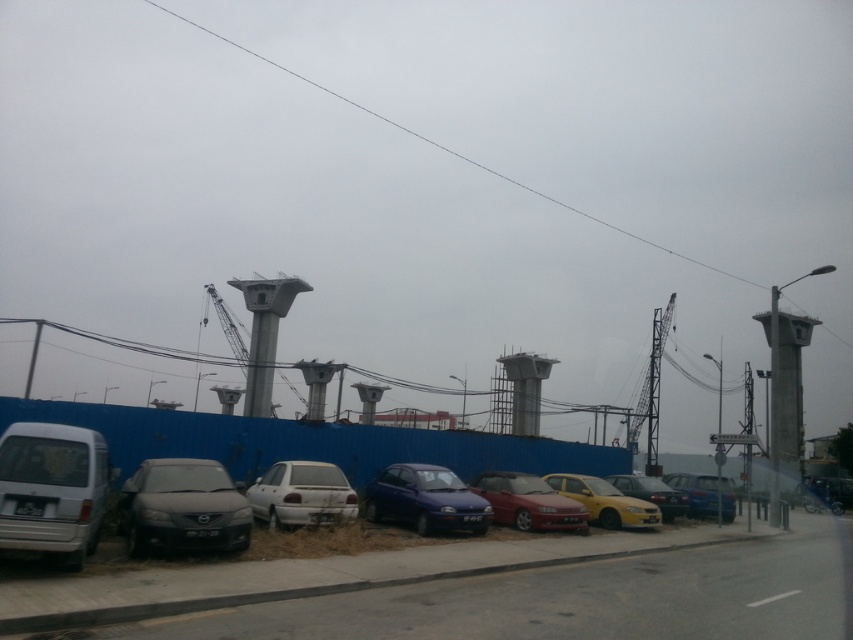
Question: Does metallic blue sedan at center-right have a greater width compared to matte black sedan at center?

Choices:
 (A) no
 (B) yes

Answer: (B)

Question: Is white matte sedan at center to the left of matte black sedan at center from the viewer's perspective?

Choices:
 (A) no
 (B) yes

Answer: (B)

Question: Which point is farther to the camera?

Choices:
 (A) (294, 460)
 (B) (699, 486)
 (C) (538, 506)
 (D) (683, 497)

Answer: (B)

Question: Which of the following is the closest to the observer?

Choices:
 (A) matte black sedan at center
 (B) metallic blue sedan at center-right

Answer: (A)

Question: Is matte black car at lower left further to the viewer compared to shiny red sedan at center?

Choices:
 (A) no
 (B) yes

Answer: (A)

Question: Estimate the real-world distances between objects in this image. Which object is farther from the matte black car at lower left?

Choices:
 (A) matte black sedan at center
 (B) metallic blue sedan at center-right
 (C) matte blue hatchback at center
 (D) yellow matte car at center

Answer: (B)